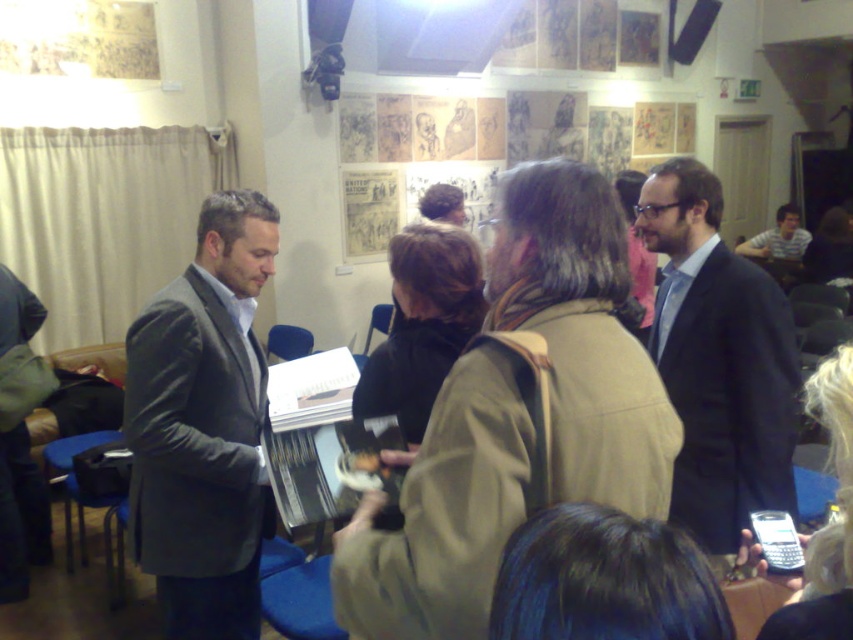
You are an event planner observing the scene. You need to arrange a path between the matte gray suit at center and the striped shirt at center for a photographer to walk through. Since the photographer is 0.8 meters wide, can they pass through the space between them?

The matte gray suit at center is positioned on the left side of striped shirt at center. The distance between them isn generated in the objects description, so we cannot determine if the photographer can pass through. More information is needed.